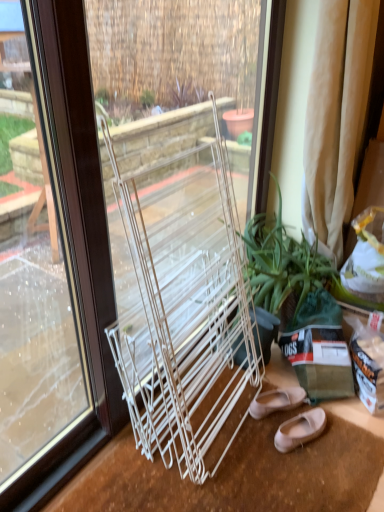
Question: Does matte pink leather ballet flats at lower right, the 1th footwear in the front-to-back sequence, lie behind clear glass window at center?

Choices:
 (A) no
 (B) yes

Answer: (B)

Question: From a real-world perspective, does matte pink leather ballet flats at lower right, the 1th footwear in the front-to-back sequence, sit lower than clear glass window at center?

Choices:
 (A) yes
 (B) no

Answer: (A)

Question: Is matte pink leather ballet flats at lower right, the 1th footwear in the front-to-back sequence, outside of clear glass window at center?

Choices:
 (A) yes
 (B) no

Answer: (A)

Question: Is matte pink leather ballet flats at lower right, the 1th footwear in the front-to-back sequence, positioned in front of clear glass window at center?

Choices:
 (A) yes
 (B) no

Answer: (B)

Question: Is matte pink leather ballet flats at lower right, the 1th footwear in the front-to-back sequence, wider than clear glass window at center?

Choices:
 (A) no
 (B) yes

Answer: (B)

Question: Are matte pink leather ballet flats at lower right, the 1th footwear in the front-to-back sequence, and clear glass window at center beside each other?

Choices:
 (A) yes
 (B) no

Answer: (B)

Question: Considering the relative sizes of beige fabric curtain at right and green leafy plant at center in the image provided, is beige fabric curtain at right taller than green leafy plant at center?

Choices:
 (A) no
 (B) yes

Answer: (B)

Question: Would you say beige fabric curtain at right is a long distance from green leafy plant at center?

Choices:
 (A) no
 (B) yes

Answer: (A)

Question: Can you confirm if beige fabric curtain at right is positioned to the right of green leafy plant at center?

Choices:
 (A) yes
 (B) no

Answer: (A)

Question: Is green leafy plant at center inside beige fabric curtain at right?

Choices:
 (A) yes
 (B) no

Answer: (B)

Question: Considering the relative sizes of beige fabric curtain at right and green leafy plant at center in the image provided, is beige fabric curtain at right smaller than green leafy plant at center?

Choices:
 (A) no
 (B) yes

Answer: (B)

Question: Is beige fabric curtain at right bigger than green leafy plant at center?

Choices:
 (A) no
 (B) yes

Answer: (A)

Question: Can you confirm if green leafy plant at center is positioned to the left of matte beige flats at lower right, arranged as the first footwear when viewed from the back?

Choices:
 (A) yes
 (B) no

Answer: (B)